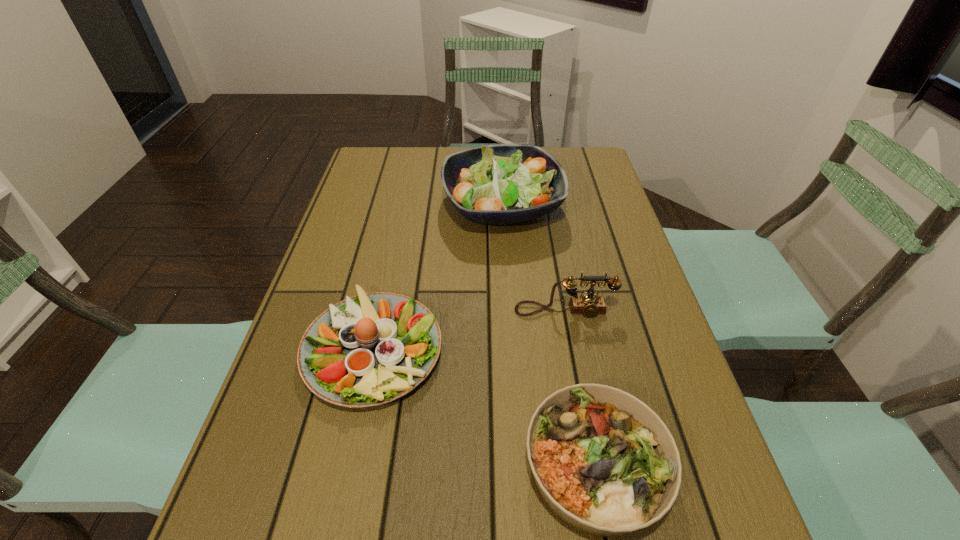
This screenshot has width=960, height=540. In order to click on the closest object to the third tallest object in this screenshot , I will do `click(604, 462)`.

The image size is (960, 540). I want to click on the third closest object relative to the shortest object, so click(x=498, y=184).

This screenshot has height=540, width=960. What are the coordinates of `the closest salad plate to the tallest object` in the screenshot? It's located at (368, 350).

Identify which salad plate is the second closest to the second shortest object. Please provide its 2D coordinates. Your answer should be formatted as a tuple, i.e. [(x, y)], where the tuple contains the x and y coordinates of a point satisfying the conditions above.

[(498, 184)]